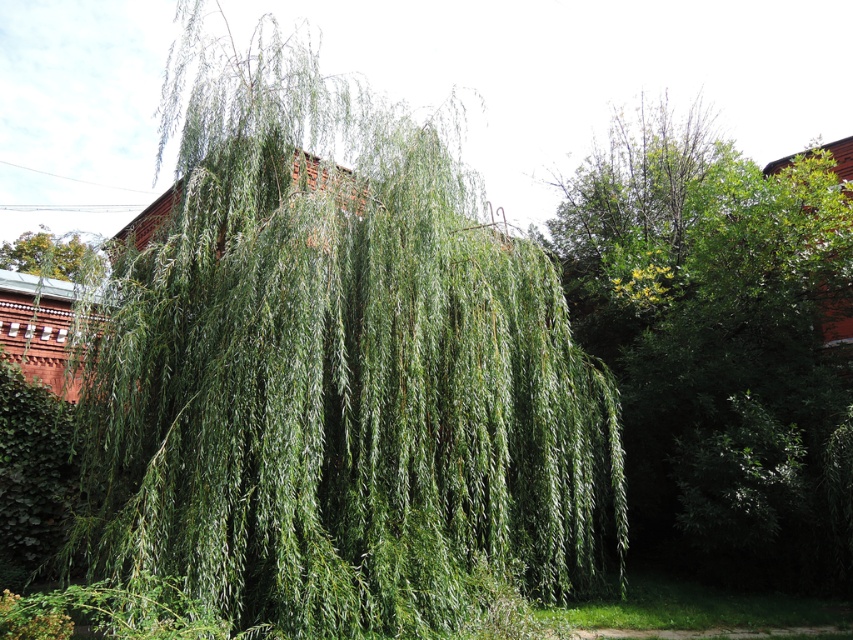
You are an artist sketching the scene and want to draw the green leafy willow at center and the green leafy tree at center. Which one should you draw first to create the proper layering?

You should draw the green leafy tree at center first because the green leafy willow at center is in front of it, so the willow needs to be layered on top.

Based on the scene, which object is shorter between the green leafy willow at center and the green leafy tree at center?

The green leafy willow at center is shorter than the green leafy tree at center according to the description.

You are standing in front of the weeping willow tree and looking at the two points marked in the image. Which point, point (175, 269) or point (704, 445), is closer to you?

Point (175, 269) is closer to the camera than point (704, 445), so the point closer to you is point (175, 269).